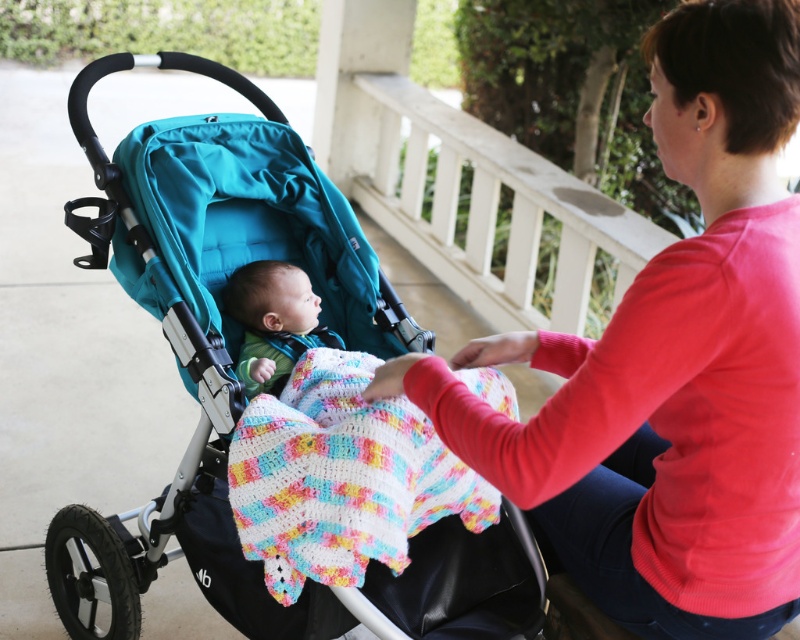
You are a photographer setting up a shot of the baby in the stroller. You need to ensure both the multicolored crocheted blanket at center and the soft green knit sweater at center are clearly visible. Which item should you focus on to ensure the wider one is properly framed?

The multicolored crocheted blanket at center should be focused on since its width surpasses that of the soft green knit sweater at center, ensuring the wider item is properly framed.

From the picture: The baby is wearing the soft green knit sweater at center and is covered by the multicolored crocheted blanket at center. Which item is bigger in size?

The multicolored crocheted blanket at center is larger in size compared to the soft green knit sweater at center.

You are standing on the patio and want to hand the baby a toy. The toy is currently placed at point A. To ensure you don not block the baby from the sunlight coming from the left, where should you position yourself relative to the matte red sweater at center?

Since the matte red sweater at center is located at point [672,365], you should position yourself to the right of the matte red sweater at center to avoid blocking the sunlight coming from the left.